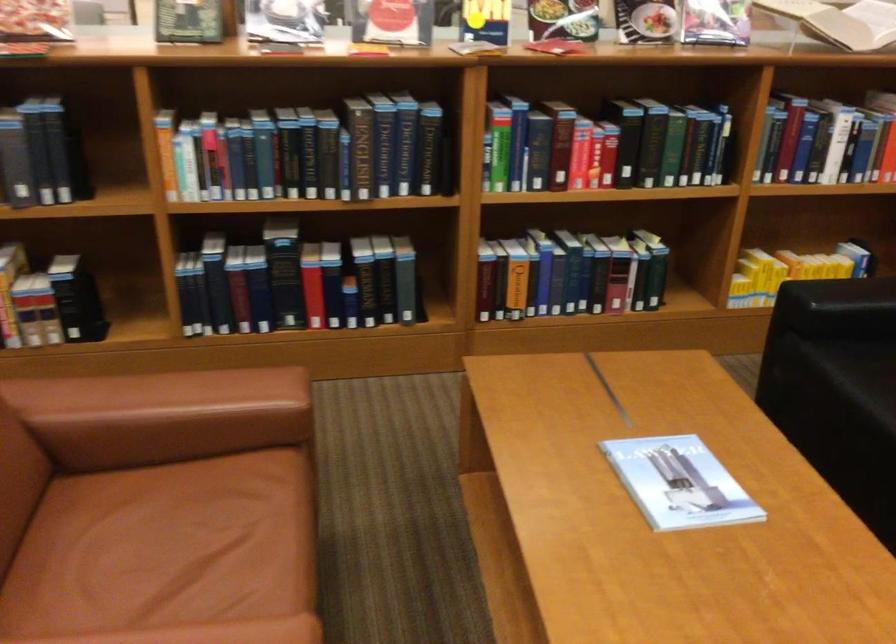
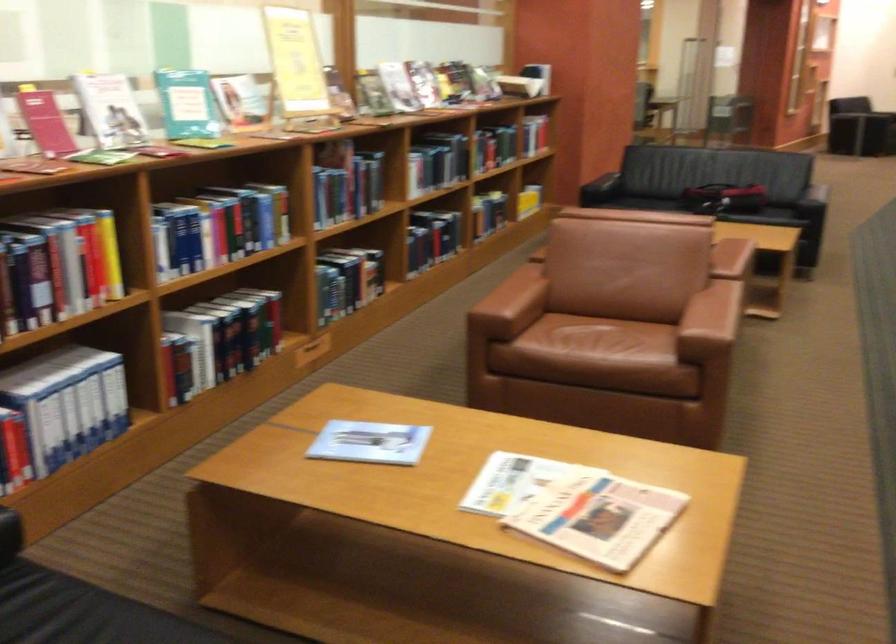
Question: I am providing you with two images of the same scene from different viewpoints. Please identify which objects are invisible in image2.

Choices:
 (A) book on shelf
 (B) glass jar with red lid
 (C) book on table
 (D) brown chair sitting surface

Answer: (C)